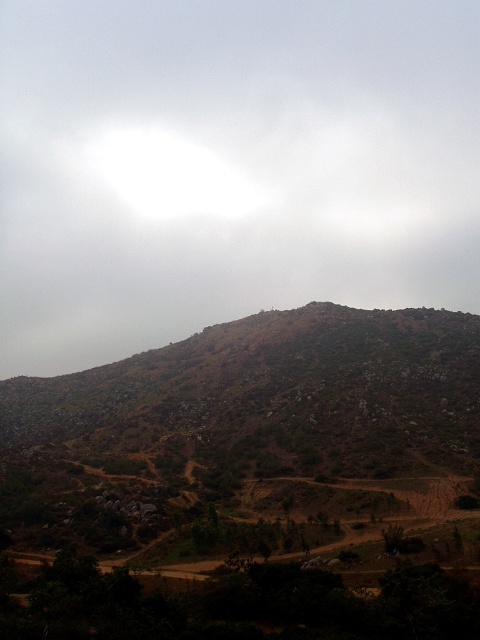
Question: Which of the following is the closest to the observer?

Choices:
 (A) brown rocky mountain at center
 (B) white fluffy cloud at upper center

Answer: (A)

Question: Does white fluffy cloud at upper center have a greater width compared to brown rocky mountain at center?

Choices:
 (A) yes
 (B) no

Answer: (A)

Question: Which point is closer to the camera?

Choices:
 (A) white fluffy cloud at upper center
 (B) brown rocky mountain at center

Answer: (B)

Question: Can you confirm if white fluffy cloud at upper center is positioned to the right of brown rocky mountain at center?

Choices:
 (A) yes
 (B) no

Answer: (A)

Question: Which point appears closest to the camera in this image?

Choices:
 (A) (146, 394)
 (B) (420, 276)

Answer: (A)

Question: Can you confirm if white fluffy cloud at upper center is positioned above brown rocky mountain at center?

Choices:
 (A) no
 (B) yes

Answer: (B)